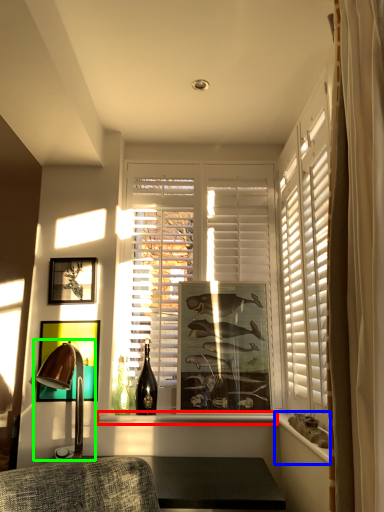
Question: Considering the real-world distances, which object is farthest from window sill (highlighted by a red box)? ledge (highlighted by a blue box) or table lamp (highlighted by a green box)?

Choices:
 (A) ledge
 (B) table lamp

Answer: (A)